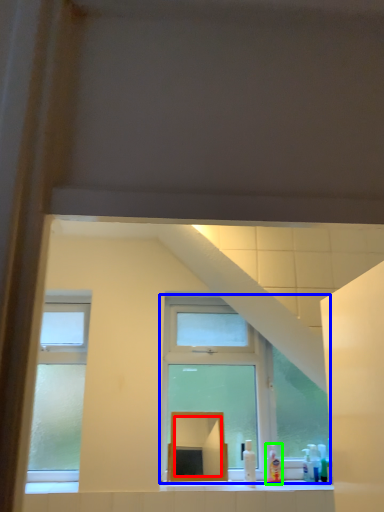
Question: Which object is positioned closest to mirror (highlighted by a red box)? Select from window (highlighted by a blue box) and toiletry (highlighted by a green box).

Choices:
 (A) window
 (B) toiletry

Answer: (A)